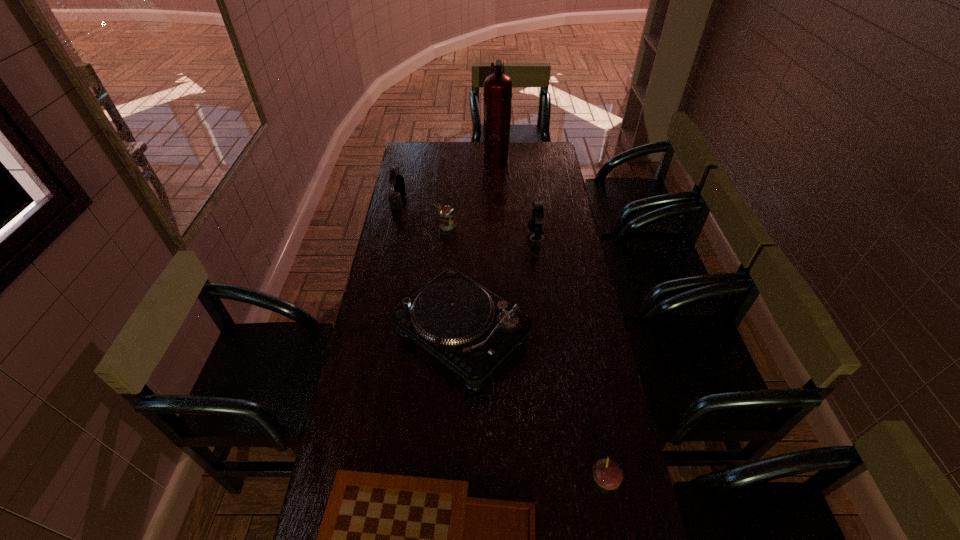
This screenshot has height=540, width=960. Find the location of `vacant point located between the earphone and the record player`. vacant point located between the earphone and the record player is located at coordinates (498, 285).

Identify the location of free space between the earphone and the headset. The image size is (960, 540). coord(467,218).

Select which object appears as the fourth closest to the fire extinguisher. Please provide its 2D coordinates. Your answer should be formatted as a tuple, i.e. [(x, y)], where the tuple contains the x and y coordinates of a point satisfying the conditions above.

[(471, 330)]

Locate an element on the screen. object that is the closest to the fifth farthest object is located at coordinates (535, 224).

Where is `vacant space that satisfies the following two spatial constraints: 1. on the front side of the cupcake; 2. on the left side of the can`? This screenshot has height=540, width=960. vacant space that satisfies the following two spatial constraints: 1. on the front side of the cupcake; 2. on the left side of the can is located at coordinates (425, 480).

Identify the location of free spot that satisfies the following two spatial constraints: 1. on the back side of the cupcake; 2. on the nozzle side of the farthest object. (543, 153).

Find the location of a particular element. Image resolution: width=960 pixels, height=540 pixels. blank space that satisfies the following two spatial constraints: 1. on the nozzle side of the farthest object; 2. on the left side of the cupcake is located at coordinates (512, 480).

At what (x,y) coordinates should I click in order to perform the action: click on free spot that satisfies the following two spatial constraints: 1. on the headband of the sixth nearest object; 2. on the right side of the record player. Please return your answer as a coordinate pair (x, y). This screenshot has height=540, width=960. Looking at the image, I should click on (370, 333).

Locate an element on the screen. The image size is (960, 540). vacant space that satisfies the following two spatial constraints: 1. on the nozzle side of the cupcake; 2. on the left side of the fire extinguisher is located at coordinates (512, 480).